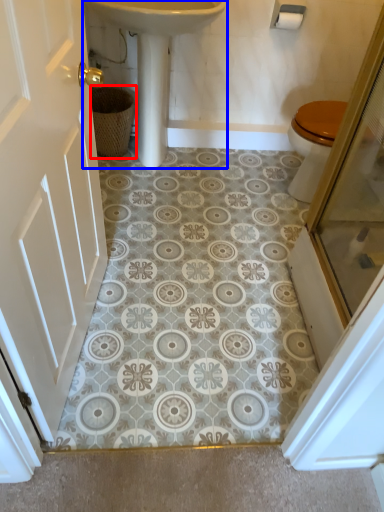
Question: Among these objects, which one is farthest to the camera, basket (highlighted by a red box) or sink (highlighted by a blue box)?

Choices:
 (A) basket
 (B) sink

Answer: (A)